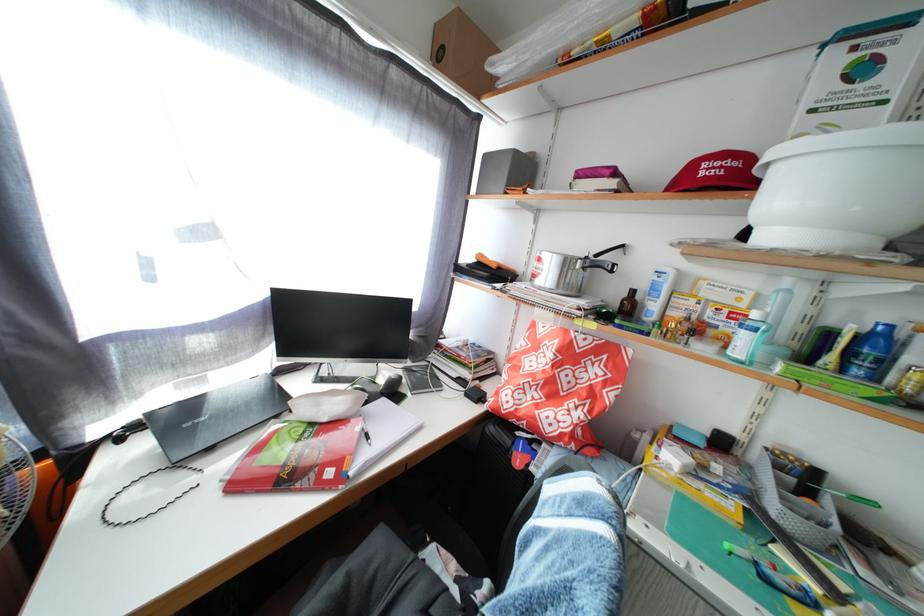
Where is `small brown bottle`? small brown bottle is located at coordinates (627, 304).